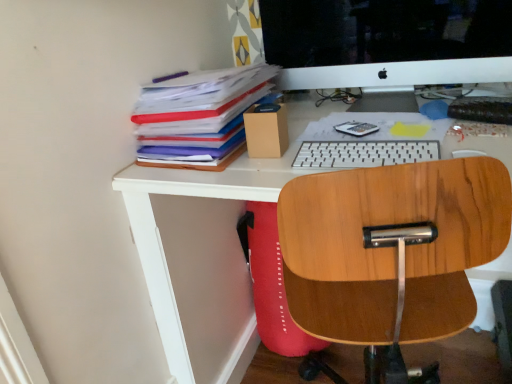
Question: Is wooden office chair at center at the back of white plastic keyboard at center?

Choices:
 (A) no
 (B) yes

Answer: (B)

Question: Does white plastic keyboard at center appear on the left side of wooden office chair at center?

Choices:
 (A) yes
 (B) no

Answer: (A)

Question: Can you confirm if white plastic keyboard at center is positioned to the right of wooden office chair at center?

Choices:
 (A) no
 (B) yes

Answer: (A)

Question: Does white plastic keyboard at center turn towards wooden office chair at center?

Choices:
 (A) no
 (B) yes

Answer: (B)

Question: Can you confirm if white plastic keyboard at center is bigger than wooden office chair at center?

Choices:
 (A) yes
 (B) no

Answer: (B)

Question: Does white plastic keyboard at center have a lesser width compared to wooden office chair at center?

Choices:
 (A) yes
 (B) no

Answer: (A)

Question: Is white plastic keyboard at center inside white glossy computer monitor at upper center?

Choices:
 (A) yes
 (B) no

Answer: (B)

Question: Considering the relative positions of white glossy computer monitor at upper center and white plastic keyboard at center in the image provided, is white glossy computer monitor at upper center in front of white plastic keyboard at center?

Choices:
 (A) yes
 (B) no

Answer: (B)

Question: Is white glossy computer monitor at upper center oriented away from white plastic keyboard at center?

Choices:
 (A) no
 (B) yes

Answer: (A)

Question: Can you confirm if white glossy computer monitor at upper center is shorter than white plastic keyboard at center?

Choices:
 (A) yes
 (B) no

Answer: (B)

Question: From a real-world perspective, is white glossy computer monitor at upper center under white plastic keyboard at center?

Choices:
 (A) yes
 (B) no

Answer: (B)

Question: Does white glossy computer monitor at upper center have a greater width compared to white plastic keyboard at center?

Choices:
 (A) no
 (B) yes

Answer: (B)

Question: Does multicolored paper at upper left have a smaller size compared to white plastic keyboard at center?

Choices:
 (A) no
 (B) yes

Answer: (A)